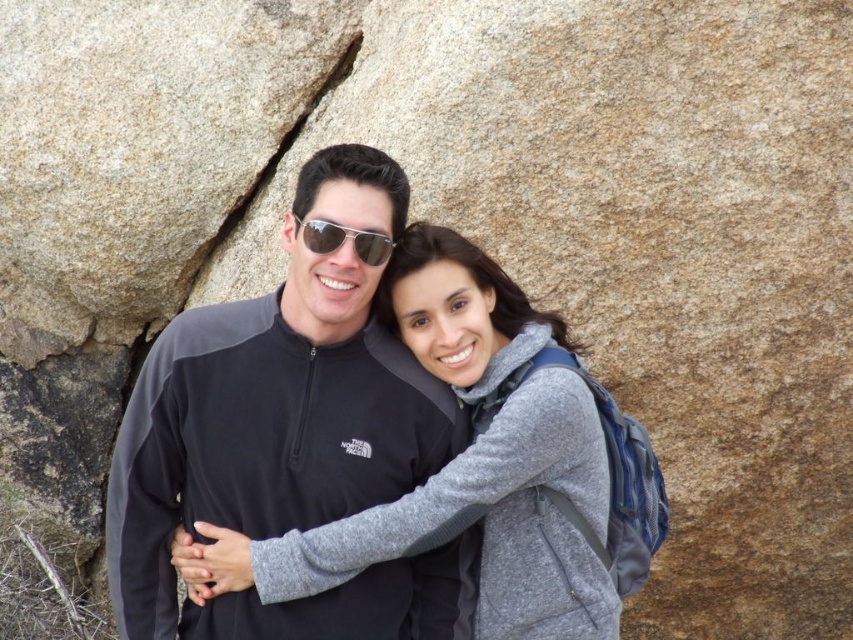
You are a photographer trying to capture a candid shot of the two people in the scene. You notice the matte black jacket at center and the sunglasses at center. Which object is positioned to the left of the other?

The matte black jacket at center is to the left of the sunglasses at center.

You are a photographer trying to capture a closeup of the sunglasses at center and the matte black jacket at center in the image. Since you want both items to be clearly visible in the frame, which object should you focus on first to ensure it fits properly?

The matte black jacket at center is wider than the sunglasses at center, so you should focus on the matte black jacket at center first to ensure it fits properly in the frame.